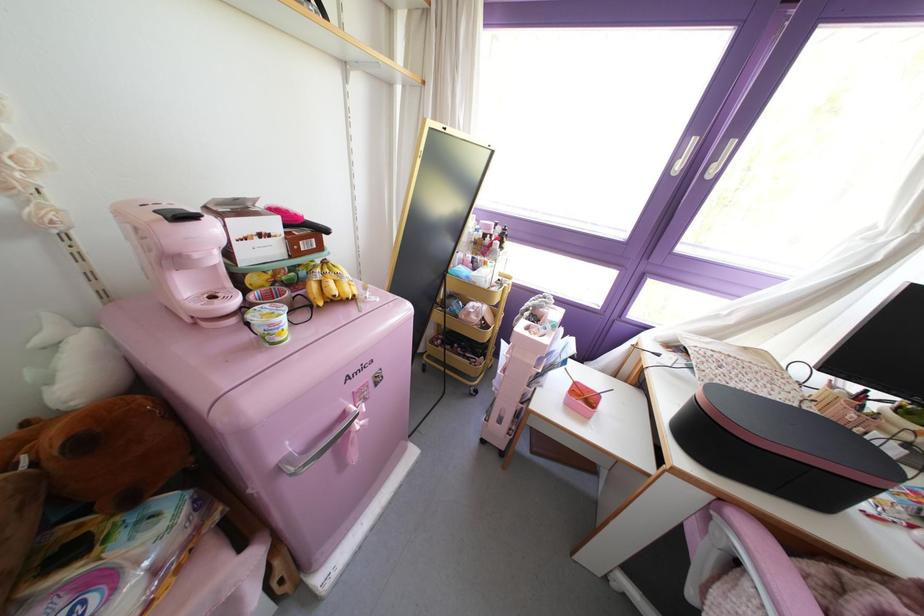
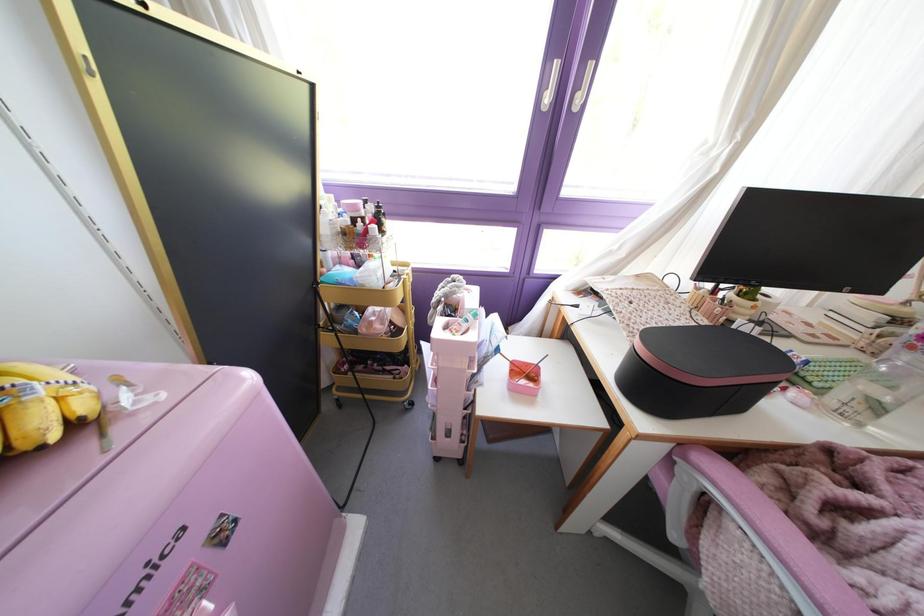
Question: The first image is from the beginning of the video and the second image is from the end. How did the camera likely rotate when shooting the video?

Choices:
 (A) Left
 (B) Right
 (C) Up
 (D) Down

Answer: (B)